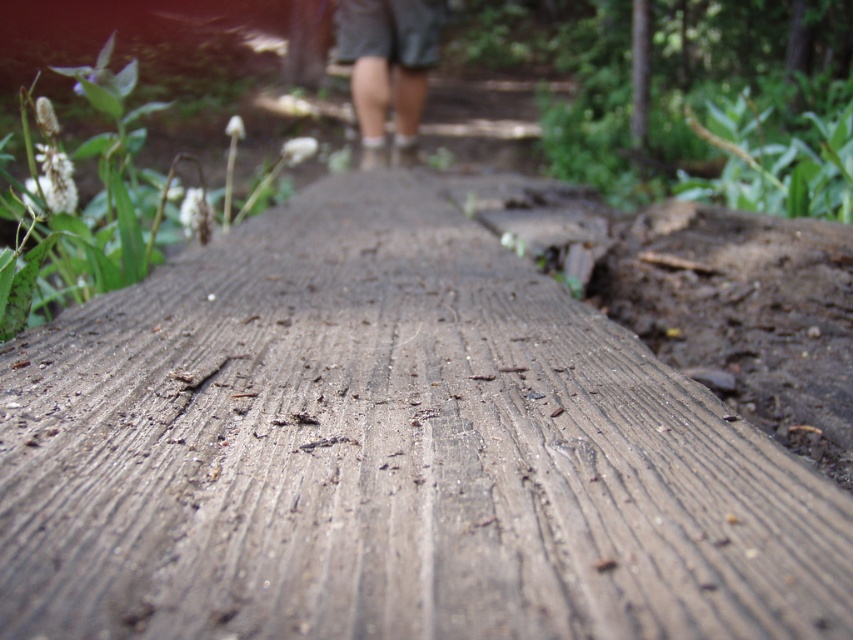
Is point (688, 550) positioned before point (357, 104)?

Yes.

From the picture: Between weathered wood at center and dark green shorts at center, which one has more height?

Standing taller between the two is dark green shorts at center.

Where is `weathered wood at center`? The image size is (853, 640). weathered wood at center is located at coordinates (389, 452).